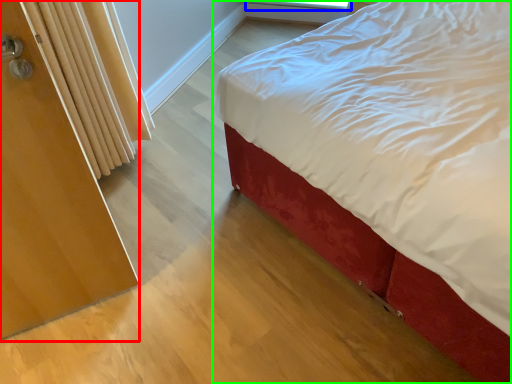
Question: Estimate the real-world distances between objects in this image. Which object is closer to screen door (highlighted by a red box), window screen (highlighted by a blue box) or bed (highlighted by a green box)?

Choices:
 (A) window screen
 (B) bed

Answer: (B)